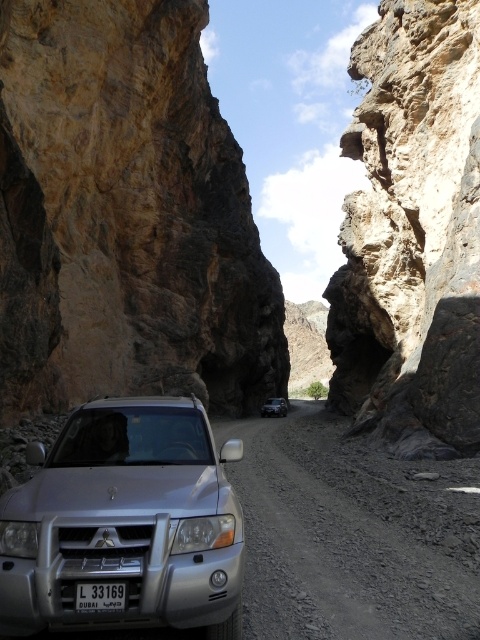
Question: Which point appears farthest from the camera in this image?

Choices:
 (A) (450, 20)
 (B) (276, 400)
 (C) (40, 566)

Answer: (B)

Question: Which object is the farthest from the satin silver suv at center?

Choices:
 (A) black plastic license plate at center
 (B) silver metallic suv at center
 (C) rustic brown rock at center
 (D) rustic stone arch at center

Answer: (A)

Question: Does silver metallic suv at center come behind rugged stone mountain at center?

Choices:
 (A) yes
 (B) no

Answer: (B)

Question: Does silver metallic suv at center have a lesser width compared to satin silver suv at center?

Choices:
 (A) yes
 (B) no

Answer: (A)

Question: Which point is closer to the camera?

Choices:
 (A) (118, 452)
 (B) (381, 282)

Answer: (A)

Question: Does rustic brown rock at center have a smaller size compared to black plastic license plate at center?

Choices:
 (A) yes
 (B) no

Answer: (B)